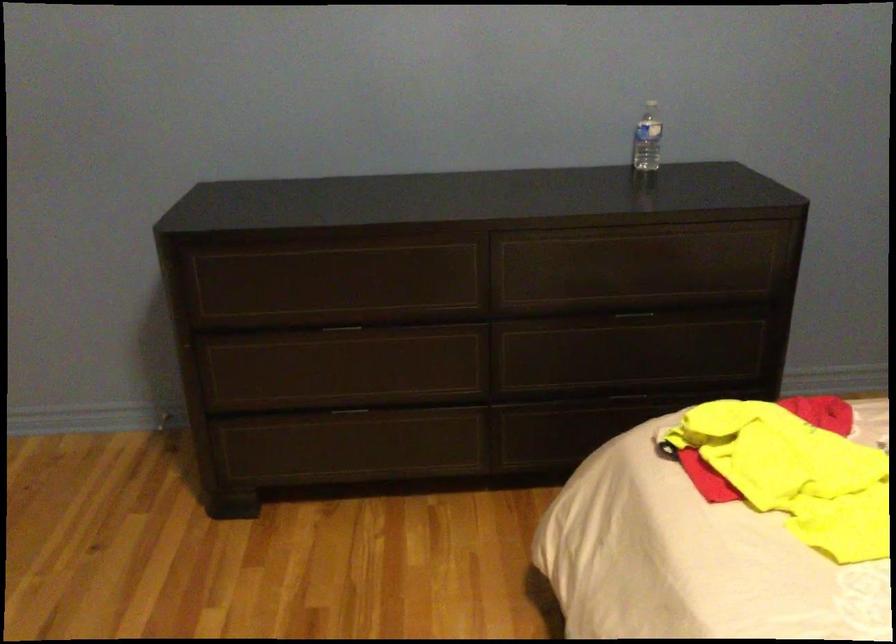
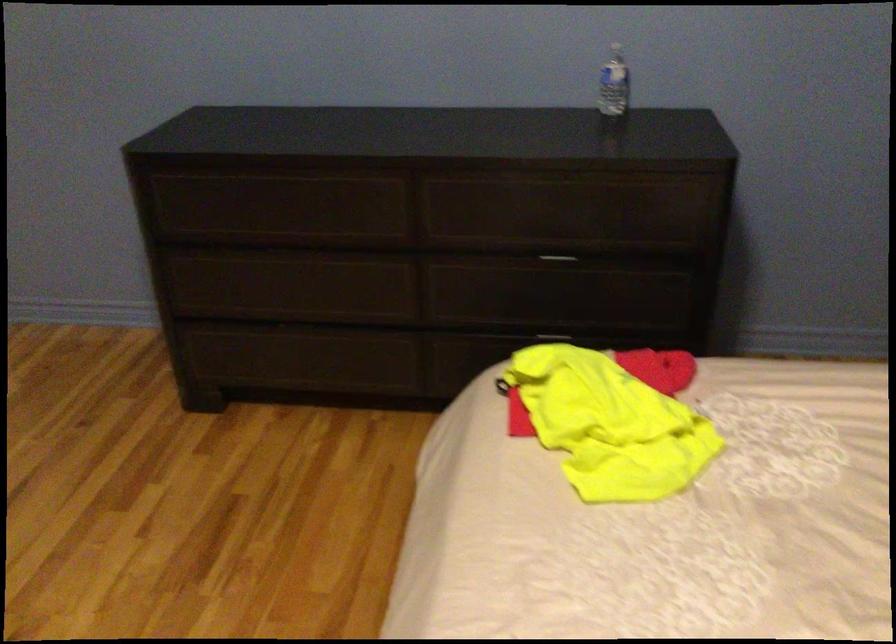
Locate, in the second image, the point that corresponds to the point at 632,392 in the first image.

(553, 333)